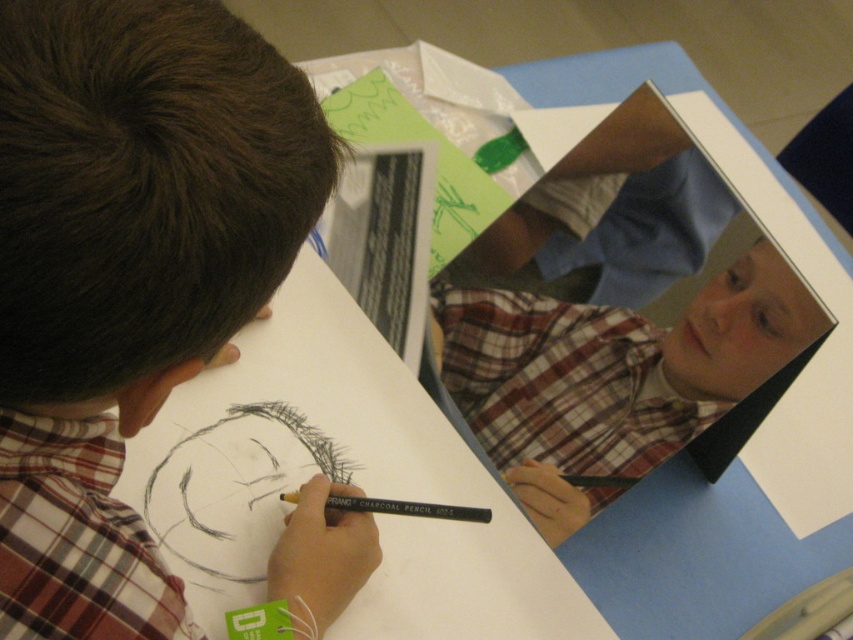
The height and width of the screenshot is (640, 853). Identify the location of plaid shirt at upper left. (128, 273).

Does plaid shirt at upper left have a lesser height compared to charcoal pencil at center?

Incorrect, plaid shirt at upper left's height does not fall short of charcoal pencil at center's.

Does point (107, 314) come in front of point (451, 506)?

Yes, it is in front of point (451, 506).

Find the location of a particular element. This screenshot has width=853, height=640. plaid shirt at upper left is located at coordinates (128, 273).